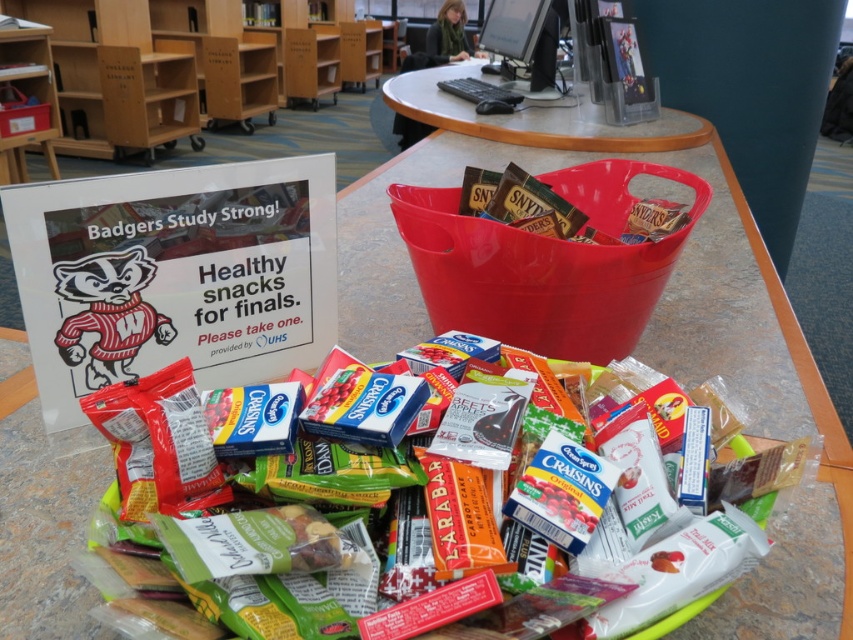
You are a student trying to find the matte plastic bag of mixed snacks at center in the library display. From your current position, which side of the light brown wood bookshelf at upper left should you look to locate it?

The matte plastic bag of mixed snacks at center is on the right side of the light brown wood bookshelf at upper left, so you should look to the right side of the bookshelf to find it.

You are a student who wants to place the matte plastic bag of mixed snacks at center on the right side of the wooden table at center. Is there enough space on the table to move it there?

The matte plastic bag of mixed snacks at center is currently on the left side of the wooden table at center. Since the question is about moving it to the right side, there should be enough space as the table is at center and the bag is only on one side. However, without knowing the table size or other items, it is assumed possible based on the given info.

What is the spatial relationship between the light brown wood bookshelf at upper left and the wooden table at center?

The light brown wood bookshelf at upper left is to the left of the wooden table at center.